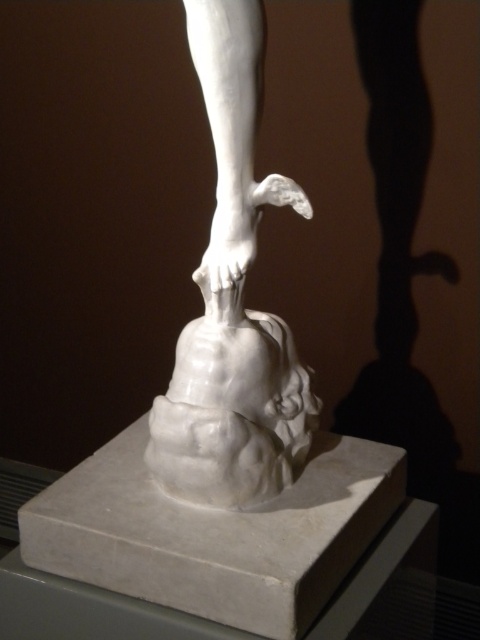
Who is positioned more to the right, white marble sculpture at center or white marble person at center?

From the viewer's perspective, white marble sculpture at center appears more on the right side.

Does white marble sculpture at center have a lesser height compared to white marble person at center?

No, white marble sculpture at center is not shorter than white marble person at center.

Find the location of a particular element. This screenshot has height=640, width=480. white marble sculpture at center is located at coordinates (232, 301).

Identify the location of white marble sculpture at center. The height and width of the screenshot is (640, 480). (232, 301).